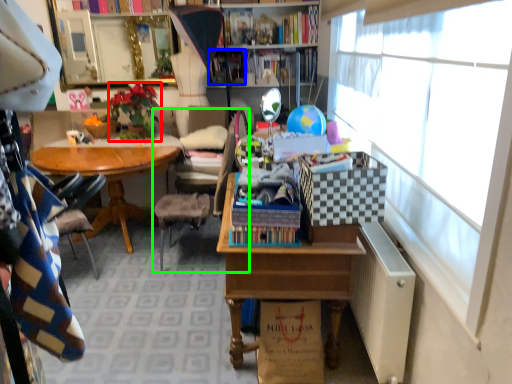
Question: Which object is positioned farthest from houseplant (highlighted by a red box)? Select from book (highlighted by a blue box) and chair (highlighted by a green box).

Choices:
 (A) book
 (B) chair

Answer: (A)